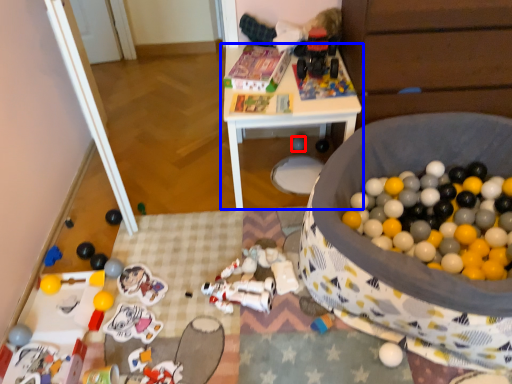
Question: Which object appears farthest to the camera in this image, toy (highlighted by a red box) or table (highlighted by a blue box)?

Choices:
 (A) toy
 (B) table

Answer: (A)